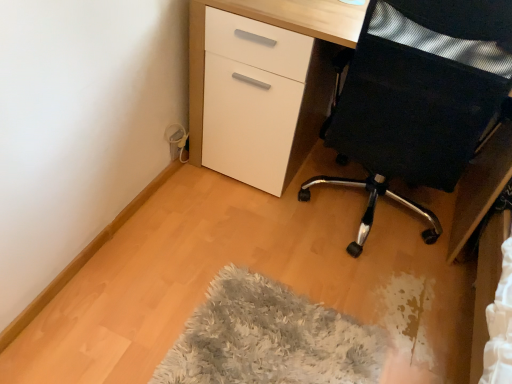
Question: From a real-world perspective, is white glossy desk at center physically located above or below black mesh chair at right?

Choices:
 (A) below
 (B) above

Answer: (A)

Question: Is white glossy desk at center wider or thinner than black mesh chair at right?

Choices:
 (A) thin
 (B) wide

Answer: (B)

Question: Estimate the real-world distances between objects in this image. Which object is farther from the fluffy gray mat at lower center?

Choices:
 (A) black mesh chair at right
 (B) white glossy desk at center

Answer: (B)

Question: Which object is positioned closest to the black mesh chair at right?

Choices:
 (A) white glossy desk at center
 (B) fluffy gray mat at lower center

Answer: (A)